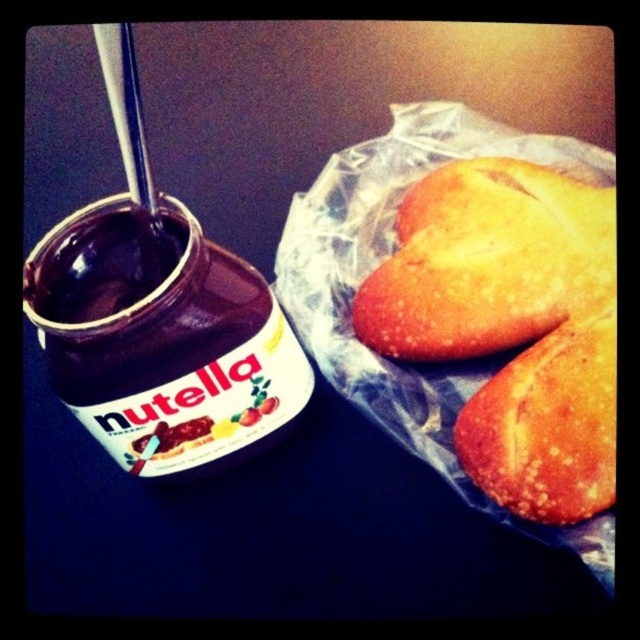
Does golden crispy bread at upper right have a larger size compared to golden crusty bread at right?

Yes, golden crispy bread at upper right is bigger than golden crusty bread at right.

Is point (545, 314) positioned behind point (576, 408)?

Yes, point (545, 314) is behind point (576, 408).

Identify the location of golden crispy bread at upper right. This screenshot has width=640, height=640. (486, 260).